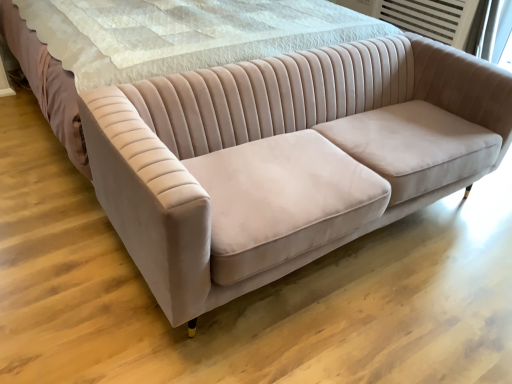
Question: Should I look upward or downward to see velvet beige bed at center?

Choices:
 (A) down
 (B) up

Answer: (B)

Question: From the image's perspective, does matte pink velvet couch at center appear lower than velvet beige bed at center?

Choices:
 (A) yes
 (B) no

Answer: (A)

Question: Considering the relative positions of matte pink velvet couch at center and velvet beige bed at center in the image provided, is matte pink velvet couch at center behind velvet beige bed at center?

Choices:
 (A) yes
 (B) no

Answer: (B)

Question: Does matte pink velvet couch at center turn towards velvet beige bed at center?

Choices:
 (A) yes
 (B) no

Answer: (B)

Question: From a real-world perspective, does matte pink velvet couch at center sit lower than velvet beige bed at center?

Choices:
 (A) no
 (B) yes

Answer: (B)

Question: Is matte pink velvet couch at center in front of velvet beige bed at center?

Choices:
 (A) yes
 (B) no

Answer: (A)

Question: Could velvet beige bed at center be considered to be inside matte pink velvet couch at center?

Choices:
 (A) no
 (B) yes

Answer: (A)

Question: Does velvet beige bed at center have a greater height compared to matte pink velvet couch at center?

Choices:
 (A) yes
 (B) no

Answer: (A)

Question: Is velvet beige bed at center thinner than matte pink velvet couch at center?

Choices:
 (A) no
 (B) yes

Answer: (A)

Question: From the image's perspective, does velvet beige bed at center appear lower than matte pink velvet couch at center?

Choices:
 (A) yes
 (B) no

Answer: (B)

Question: Can matte pink velvet couch at center be found inside velvet beige bed at center?

Choices:
 (A) yes
 (B) no

Answer: (B)

Question: Is velvet beige bed at center to the left of matte pink velvet couch at center from the viewer's perspective?

Choices:
 (A) no
 (B) yes

Answer: (B)

Question: Is velvet beige bed at center oriented away from matte pink velvet couch at center?

Choices:
 (A) no
 (B) yes

Answer: (A)

Question: Is matte pink velvet couch at center situated inside velvet beige bed at center or outside?

Choices:
 (A) inside
 (B) outside

Answer: (B)